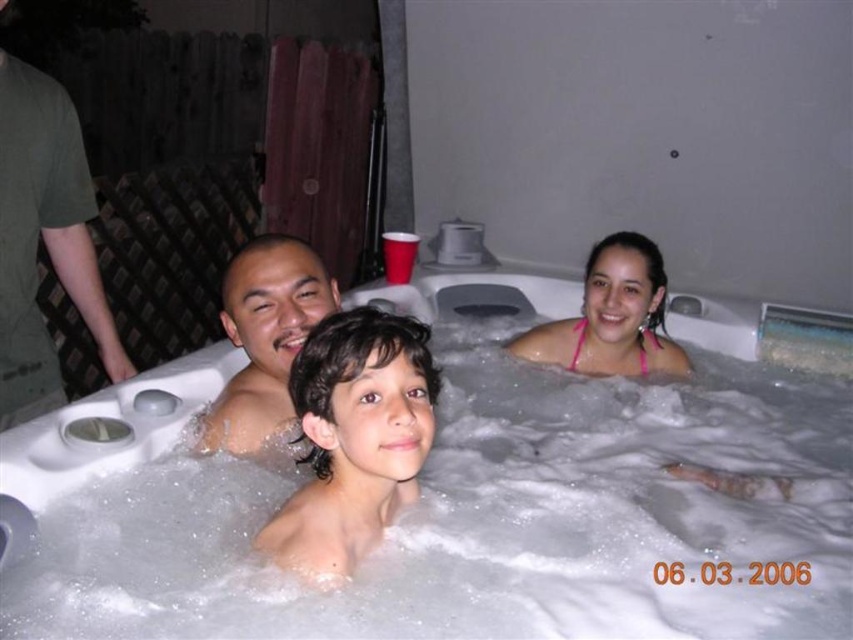
You are a photographer trying to capture a clear shot of the dark brown hair at center and the white bubbly foam at center in the hot tub scene. Which object is wider in the image?

The white bubbly foam at center is wider than the dark brown hair at center.

You are a photographer trying to capture a clear shot of the dark brown hair at center and the white bubbly foam at center in the hot tub scene. Which object is blocking the view of the other?

The dark brown hair at center is behind the white bubbly foam at center, so the white bubbly foam at center is blocking the view of the dark brown hair at center.

You are standing in front of the hot tub and want to place a floating toy between the two points marked as point (459, 584) and point (351, 532). Which point is closer to you so that the toy can be placed correctly?

Point (459, 584) is closer to you than point (351, 532) because it is further to the camera, meaning it is positioned nearer in the scene.